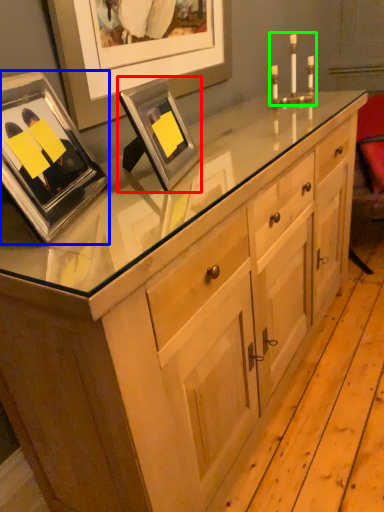
Question: Based on their relative distances, which object is nearer to picture frame (highlighted by a red box)? Choose from picture frame (highlighted by a blue box) and candle holder (highlighted by a green box).

Choices:
 (A) picture frame
 (B) candle holder

Answer: (A)